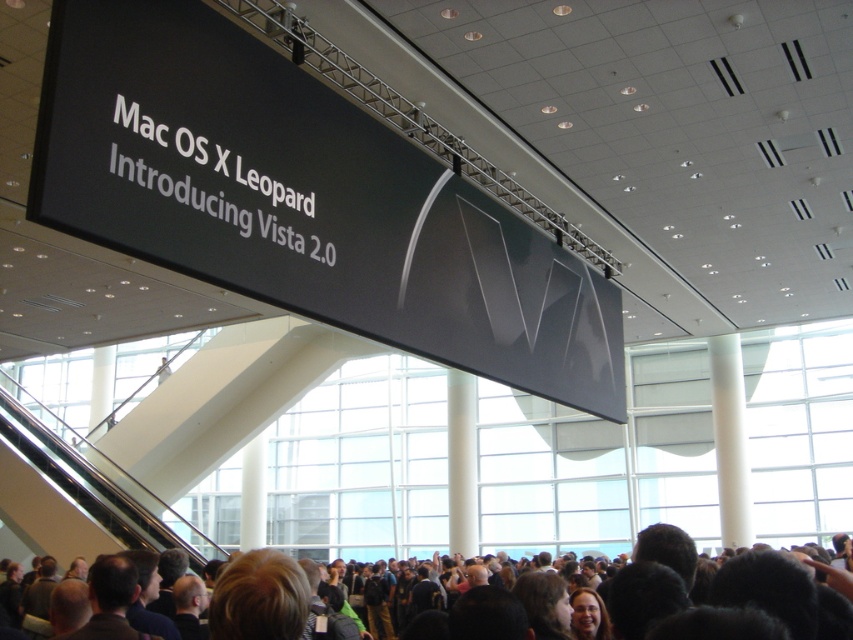
Can you confirm if black matte sign at upper center is thinner than black plastic escalator at lower left?

Yes, black matte sign at upper center is thinner than black plastic escalator at lower left.

Where is `black matte sign at upper center`? The width and height of the screenshot is (853, 640). black matte sign at upper center is located at coordinates (303, 202).

The height and width of the screenshot is (640, 853). I want to click on black matte sign at upper center, so click(x=303, y=202).

Locate an element on the screen. This screenshot has height=640, width=853. black matte sign at upper center is located at coordinates (303, 202).

Does point (428, 228) come farther from viewer compared to point (572, 600)?

Yes, point (428, 228) is behind point (572, 600).

Find the location of a particular element. black matte sign at upper center is located at coordinates (303, 202).

You are a GUI agent. You are given a task and a screenshot of the screen. Output one action in this format:
    pyautogui.click(x=<x>, y=<y>)
    Task: Click on the black matte sign at upper center
    
    Given the screenshot: What is the action you would take?
    pyautogui.click(x=303, y=202)

Who is more distant from viewer, (840,573) or (20,451)?

Point (20,451)

Does point (653, 593) lie in front of point (103, 476)?

Yes, point (653, 593) is closer to viewer.

Where is `dark brown hair at lower center`? The image size is (853, 640). dark brown hair at lower center is located at coordinates (724, 586).